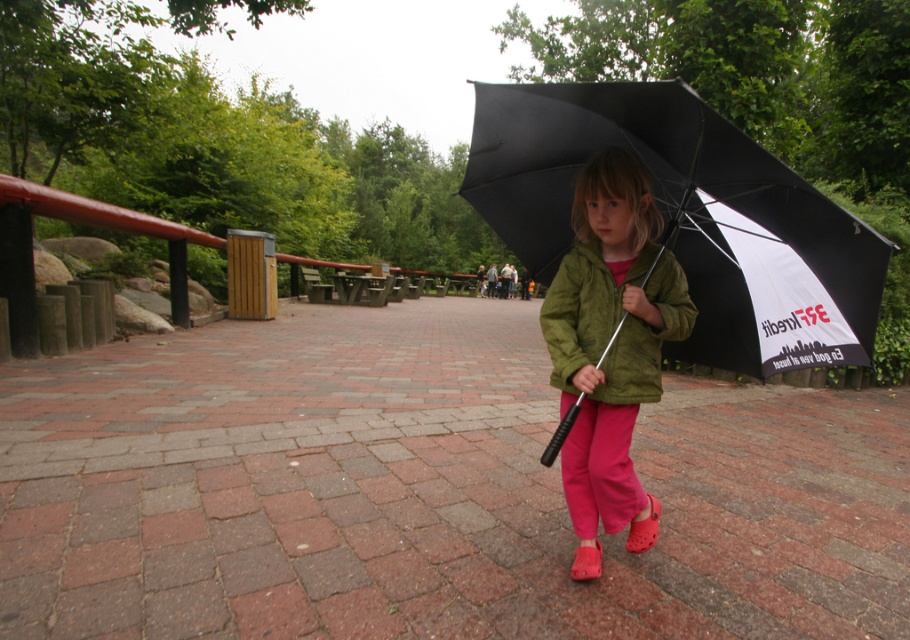
Based on the photo, the girl is wearing two jackets. The matte green jacket at center and the green suede jacket at center. Which one is closer to you?

The matte green jacket at center is closer to you than the green suede jacket at center.

You are standing at the point closer to the viewer in the image. There are two points marked in the scene, one at point (x=695, y=339) and the other at point (x=661, y=285). Which point are you standing at?

You are standing at point (x=695, y=339) because it is further to the viewer than point (x=661, y=285).